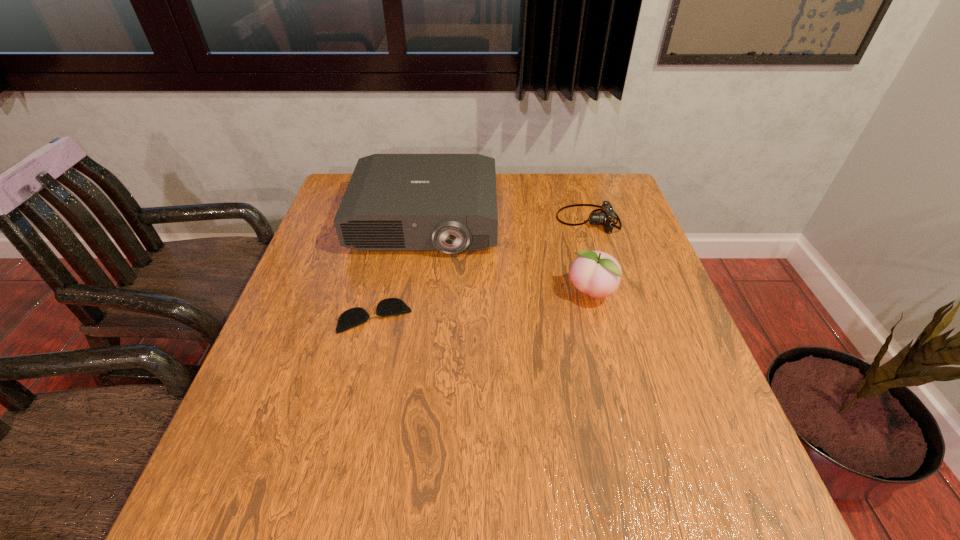
In order to click on vacant space that is in between the shortest object and the projector in this screenshot , I will do `click(400, 269)`.

Find the location of a particular element. This screenshot has width=960, height=540. object that stands as the closest to the peach is located at coordinates point(606,217).

Select which object is the closest to the spectacles. Please provide its 2D coordinates. Your answer should be formatted as a tuple, i.e. [(x, y)], where the tuple contains the x and y coordinates of a point satisfying the conditions above.

[(394, 202)]

The height and width of the screenshot is (540, 960). I want to click on free space in the image that satisfies the following two spatial constraints: 1. on the front-facing side of the peach; 2. on the right side of the projector, so click(414, 294).

Locate an element on the screen. This screenshot has height=540, width=960. free region that satisfies the following two spatial constraints: 1. on the front-facing side of the second shortest object; 2. on the front side of the shortest object is located at coordinates (617, 316).

The width and height of the screenshot is (960, 540). In order to click on vacant area that satisfies the following two spatial constraints: 1. on the front-facing side of the second shortest object; 2. on the front side of the peach in this screenshot , I will do `click(611, 294)`.